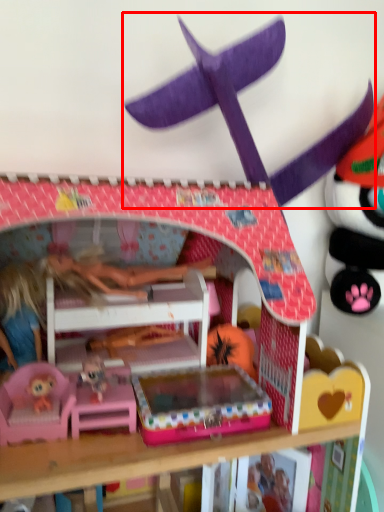
Question: From the image's perspective, where is toy (annotated by the red box) located in relation to bunk bed in the image?

Choices:
 (A) above
 (B) below

Answer: (A)